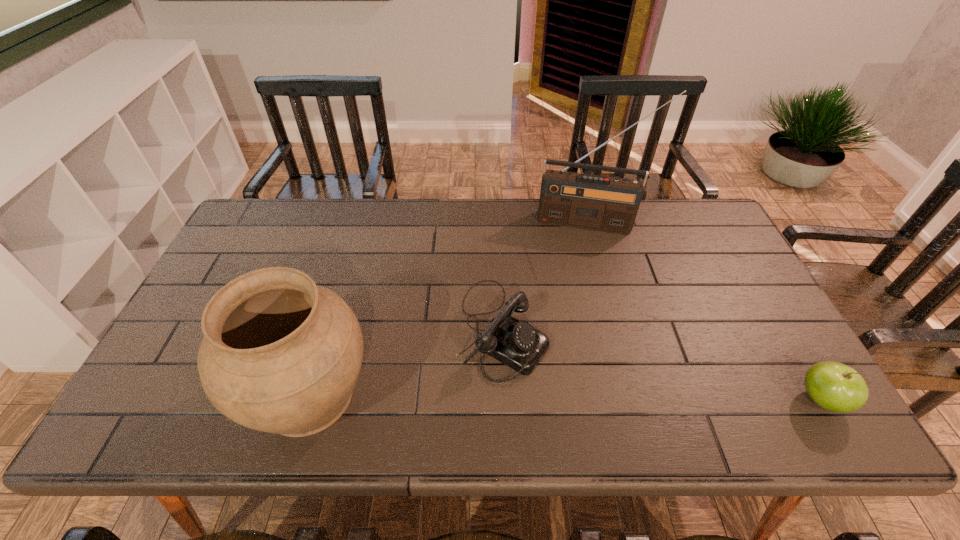
At what (x,y) coordinates should I click in order to perform the action: click on free space between the telephone and the second tallest object. Please return your answer as a coordinate pair (x, y). The height and width of the screenshot is (540, 960). Looking at the image, I should click on 405,361.

Where is `empty space that is in between the urn and the rightmost object`? empty space that is in between the urn and the rightmost object is located at coordinates (564, 397).

Where is `blank region between the radio receiver and the rightmost object`? Image resolution: width=960 pixels, height=540 pixels. blank region between the radio receiver and the rightmost object is located at coordinates (706, 311).

This screenshot has width=960, height=540. What are the coordinates of `free point between the rightmost object and the second tallest object` in the screenshot? It's located at (564, 397).

Where is `vacant space that's between the tallest object and the apple`? The image size is (960, 540). vacant space that's between the tallest object and the apple is located at coordinates (706, 311).

You are a GUI agent. You are given a task and a screenshot of the screen. Output one action in this format:
    pyautogui.click(x=<x>, y=<y>)
    Task: Click on the object that is the closest to the leftmost object
    The image size is (960, 540).
    Given the screenshot: What is the action you would take?
    pyautogui.click(x=517, y=344)

Point out which object is positioned as the third nearest to the radio receiver. Please provide its 2D coordinates. Your answer should be formatted as a tuple, i.e. [(x, y)], where the tuple contains the x and y coordinates of a point satisfying the conditions above.

[(280, 354)]

The width and height of the screenshot is (960, 540). In order to click on vacant space that satisfies the following two spatial constraints: 1. on the back side of the leftmost object; 2. on the left side of the telephone in this screenshot , I will do `click(329, 327)`.

Find the location of `blank space that satisfies the following two spatial constraints: 1. on the back side of the telephone; 2. on the left side of the urn`. blank space that satisfies the following two spatial constraints: 1. on the back side of the telephone; 2. on the left side of the urn is located at coordinates (329, 327).